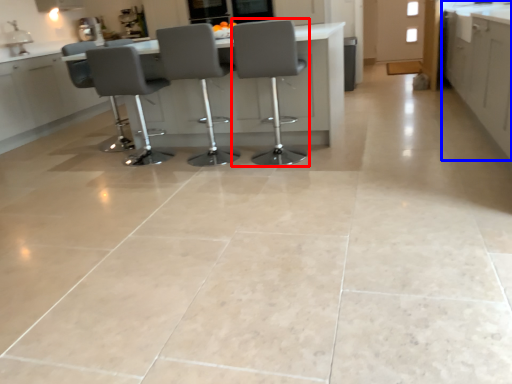
Question: Which point is closer to the camera, chair (highlighted by a red box) or cabinetry (highlighted by a blue box)?

Choices:
 (A) chair
 (B) cabinetry

Answer: (B)